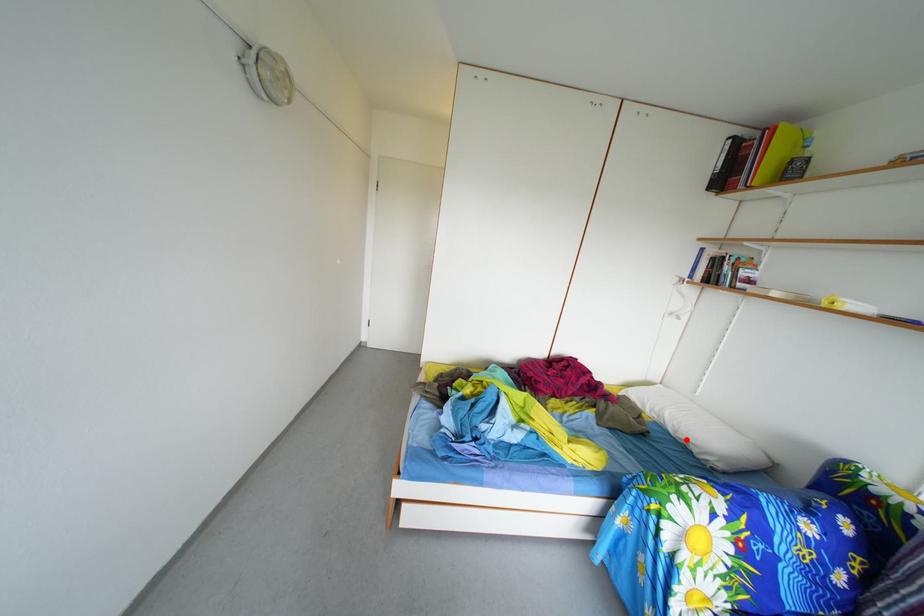
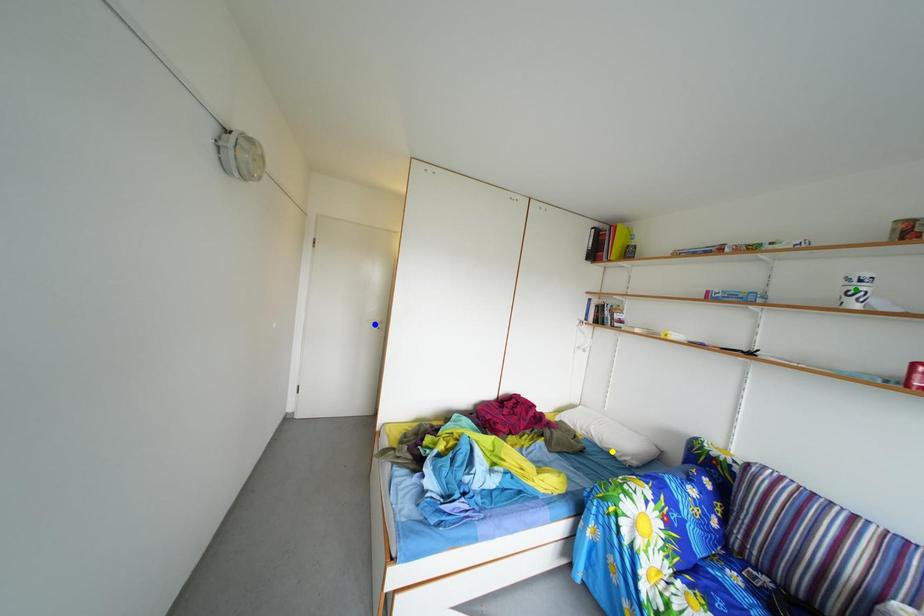
Question: I am providing you with two images of the same scene from different viewpoints. A red point is marked on the first image. You are given multiple points on the second image. Which spot in image 2 lines up with the point in image 1?

Choices:
 (A) yellow point
 (B) blue point
 (C) green point

Answer: (A)